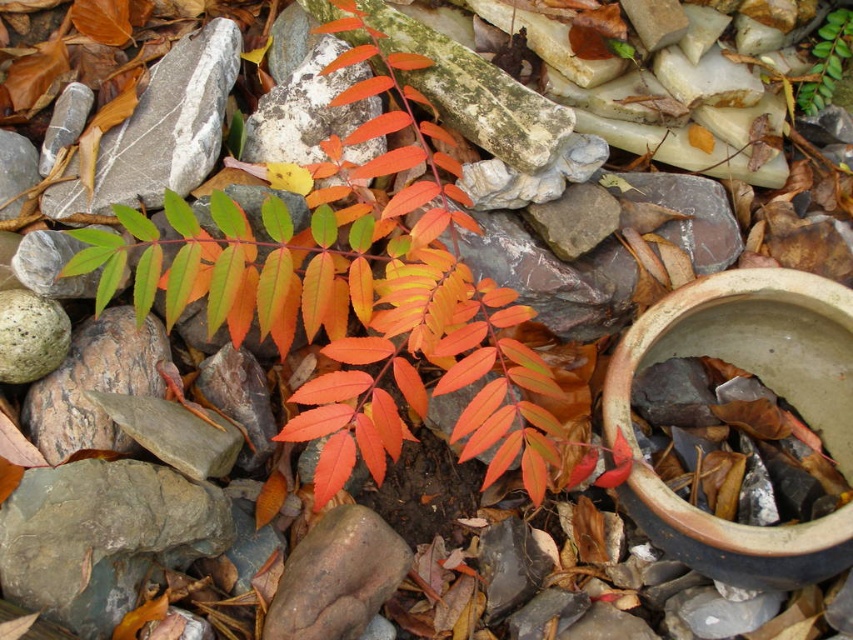
Is green matte leaf at upper center above orange matte leaf at center?

Indeed, green matte leaf at upper center is positioned over orange matte leaf at center.

Who is more distant from viewer, (828, 20) or (405, 65)?

The point (828, 20) is more distant.

Find the location of `green matte leaf at upper center`. green matte leaf at upper center is located at coordinates (825, 61).

How distant is bright orange leaves at center from green matte leaf at upper center?

bright orange leaves at center is 38.16 inches from green matte leaf at upper center.

Which is below, bright orange leaves at center or green matte leaf at upper center?

Positioned lower is bright orange leaves at center.

Who is more distant from viewer, (402, 288) or (834, 19)?

The point (834, 19) is more distant.

Image resolution: width=853 pixels, height=640 pixels. I want to click on bright orange leaves at center, so click(407, 292).

Consider the image. Is smooth gray rock at center bigger than orange matte leaf at center?

Indeed, smooth gray rock at center has a larger size compared to orange matte leaf at center.

Who is positioned more to the left, smooth gray rock at center or orange matte leaf at center?

smooth gray rock at center

Is point (335, 566) positioned before point (392, 58)?

Yes, point (335, 566) is in front of point (392, 58).

Image resolution: width=853 pixels, height=640 pixels. Identify the location of smooth gray rock at center. (337, 577).